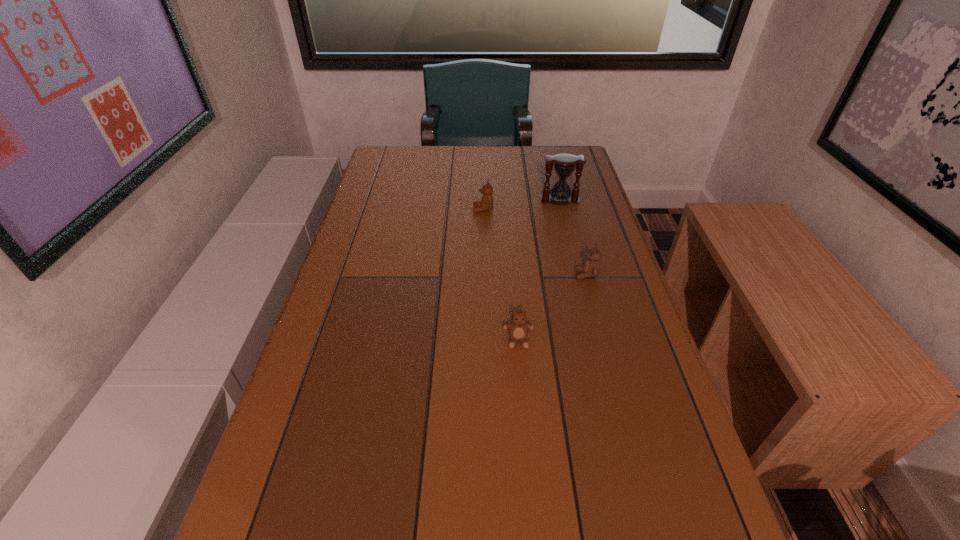
Locate an element on the screen. The image size is (960, 540). free region located 0.060m on the face of the leftmost teddy bear is located at coordinates [x=453, y=210].

At what (x,y) coordinates should I click in order to perform the action: click on blank area located on the front-facing side of the second farthest teddy bear. Please return your answer as a coordinate pair (x, y). Image resolution: width=960 pixels, height=540 pixels. Looking at the image, I should click on (435, 275).

Identify the location of vacant space located on the front-facing side of the second farthest teddy bear. This screenshot has height=540, width=960. (486, 275).

Where is `vacant space located on the front-facing side of the second farthest teddy bear`? The image size is (960, 540). vacant space located on the front-facing side of the second farthest teddy bear is located at coordinates (551, 275).

Where is `vacant region located on the front-facing side of the nearest teddy bear`? This screenshot has width=960, height=540. vacant region located on the front-facing side of the nearest teddy bear is located at coordinates (524, 417).

The image size is (960, 540). I want to click on hourglass that is at the right edge, so click(564, 165).

Locate an element on the screen. teddy bear present at the right edge is located at coordinates (591, 268).

What are the coordinates of `vacant space at the far edge of the desktop` in the screenshot? It's located at (425, 153).

Image resolution: width=960 pixels, height=540 pixels. I want to click on vacant position at the left edge of the desktop, so click(340, 262).

Where is `free space at the right edge`? free space at the right edge is located at coordinates click(x=556, y=207).